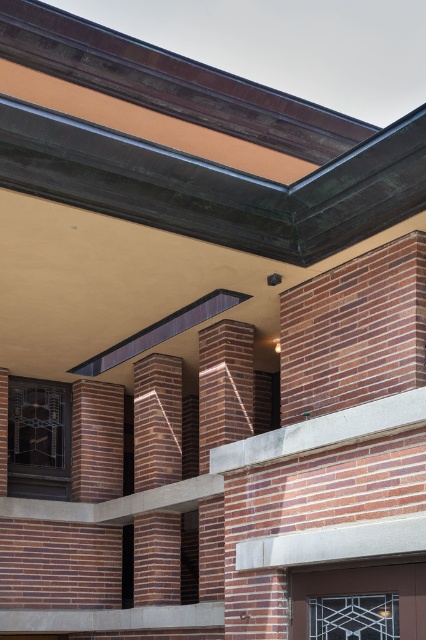
You are standing in front of the modern architectural building described. You notice two points marked on the structure. The first point is at coordinates point (391, 355) and the second is at point (226, 365). Which of these points is nearer to your current position?

Point (391, 355) is closer to the camera than point (226, 365), so it is nearer to your current position.

You are an architect designing a new building and are considering the placement of a decorative element. You have two options for placement locations based on the image provided. The first option is on the red brick wall at upper right, and the second is on the red brick pillar at center. If you want the decorative element to be more prominent due to its placement on a wider surface, which location should you choose?

You should choose the red brick wall at upper right because its width is larger than the red brick pillar at center, providing a wider surface for the decorative element to be more prominent.